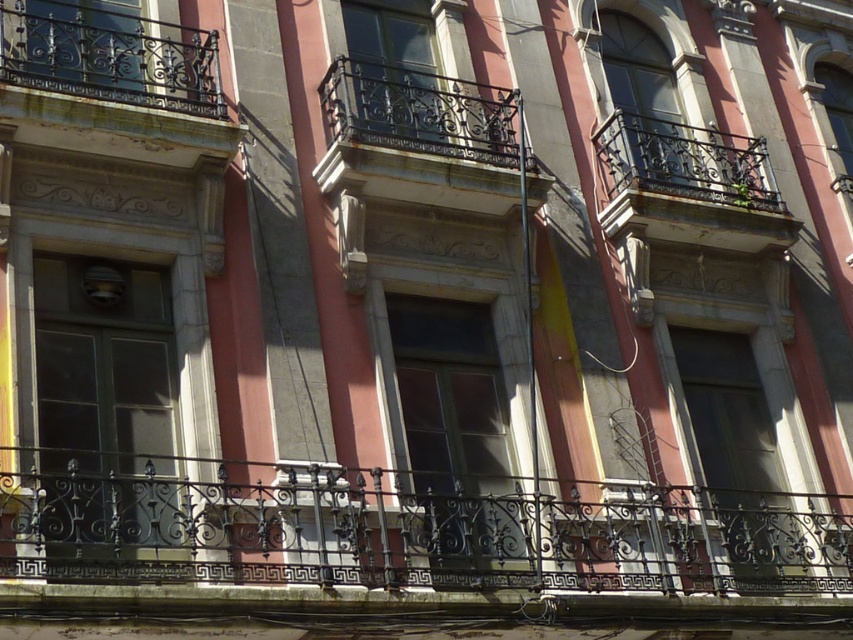
From the picture: You are standing at the point labeled point (x=753, y=513) and want to take a photo of the building facade. If your camera is set to focus at 30 meters, will it be able to clearly capture the building?

The distance between point (x=753, y=513) and the camera is 35.17 meters, which is beyond the 30 meter focus setting. Therefore, the camera will not be able to clearly capture the building from that distance.

You are standing on the second floor of the building and want to place a potted plant on the black wrought iron balcony at center. However, you are concerned about the height difference between the black wrought iron railing at center and the balcony. Which one is taller?

The black wrought iron railing at center is taller than the black wrought iron balcony at center.

You are standing at a distance from the building and want to take a photo of the point marked at coordinates point (418, 84). If your camera has a maximum zoom range of 40 meters, will you be able to capture the point clearly in your photo?

The point marked at coordinates point (418, 84) is 42.32 meters away from the camera. Since the camera can only zoom up to 40 meters, you will not be able to capture the point clearly in your photo.